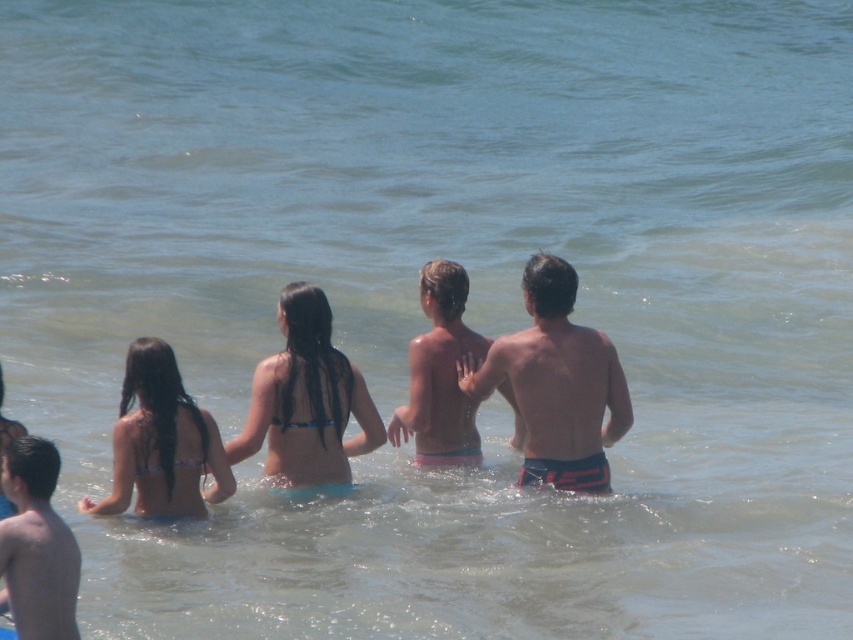
Does blue bikini top at center come behind pink fabric shorts at center?

No.

Is blue bikini top at center shorter than pink fabric shorts at center?

Yes, blue bikini top at center is shorter than pink fabric shorts at center.

Which is behind, point (361, 406) or point (450, 321)?

The point (450, 321) is more distant.

At what (x,y) coordinates should I click in order to perform the action: click on blue bikini top at center. Please return your answer as a coordinate pair (x, y). The height and width of the screenshot is (640, 853). Looking at the image, I should click on (306, 401).

In the scene shown: Is dark red swim trunks at center positioned in front of smooth skin boy at lower left?

No, dark red swim trunks at center is further to the viewer.

Is dark red swim trunks at center thinner than smooth skin boy at lower left?

No.

Who is more distant from viewer, [567,454] or [62,618]?

The point [567,454] is more distant.

Locate an element on the screen. Image resolution: width=853 pixels, height=640 pixels. dark red swim trunks at center is located at coordinates (556, 384).

Who is positioned more to the left, matte blue bikini at center or smooth skin boy at lower left?

Positioned to the left is smooth skin boy at lower left.

Looking at this image, does matte blue bikini at center have a lesser width compared to smooth skin boy at lower left?

No, matte blue bikini at center is not thinner than smooth skin boy at lower left.

Find the location of a particular element. matte blue bikini at center is located at coordinates (161, 442).